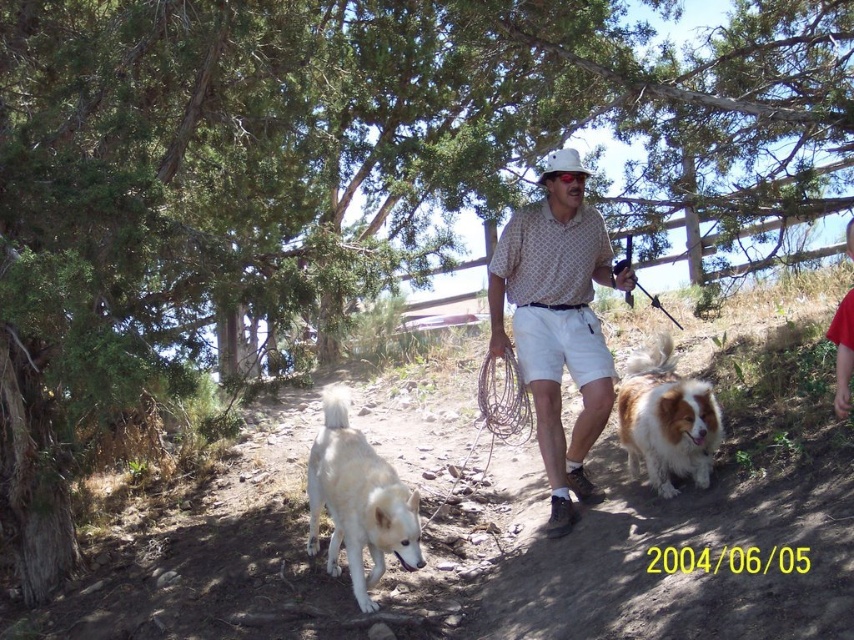
Question: Can you confirm if polka dot shirt at center is positioned above brown fluffy dog at center?

Choices:
 (A) yes
 (B) no

Answer: (A)

Question: In this image, where is white fur dog at lower left located relative to brown fluffy dog at center?

Choices:
 (A) right
 (B) left

Answer: (B)

Question: Which object appears closest to the camera in this image?

Choices:
 (A) polka dot shirt at center
 (B) brown fluffy dog at center

Answer: (B)

Question: Which of the following is the farthest from the observer?

Choices:
 (A) white fur dog at lower left
 (B) brown fluffy dog at center

Answer: (B)

Question: From the image, what is the correct spatial relationship of polka dot shirt at center in relation to brown fluffy dog at center?

Choices:
 (A) above
 (B) below

Answer: (A)

Question: Which point is closer to the camera?

Choices:
 (A) brown fluffy dog at center
 (B) polka dot shirt at center

Answer: (A)